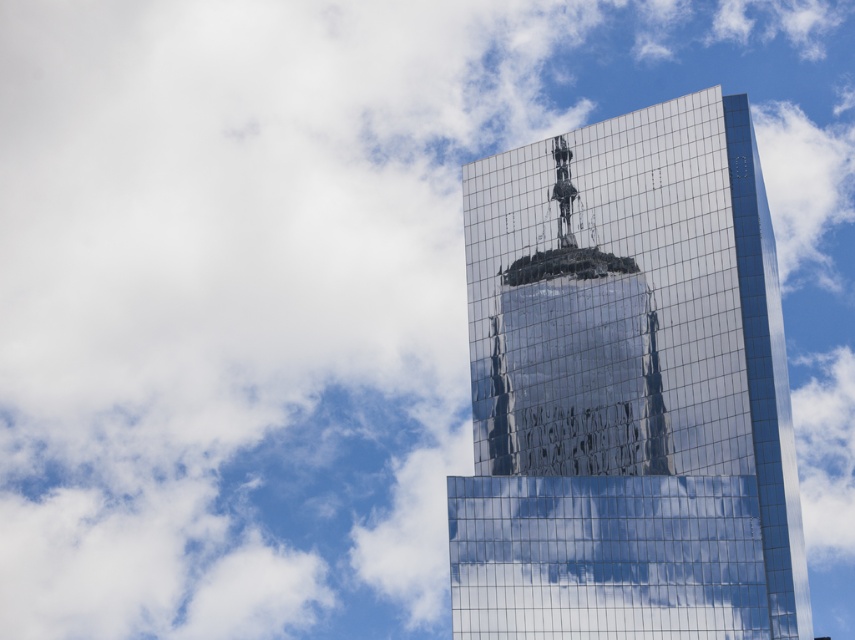
Based on the photo, what are the coordinates of the reflective glass tower at center?

The reflective glass tower at center is located at coordinates point (628, 388).

In the scene shown: You are an architect analyzing the skyscraper design. Based on the image, which object is positioned higher in the scene between the reflective glass tower at center and the glossy glass skyscraper at center?

The reflective glass tower at center is positioned higher than the glossy glass skyscraper at center in the scene.

Based on the photo, you are standing in front of the modern glass skyscraper and notice two points on its reflective facade. The first point is at coordinates point (676, 515) and the second is at point (525, 310). Which of these two points is nearer to your current position?

Point (676, 515) is closer to the viewer than point (525, 310), so the first point is nearer to your current position.